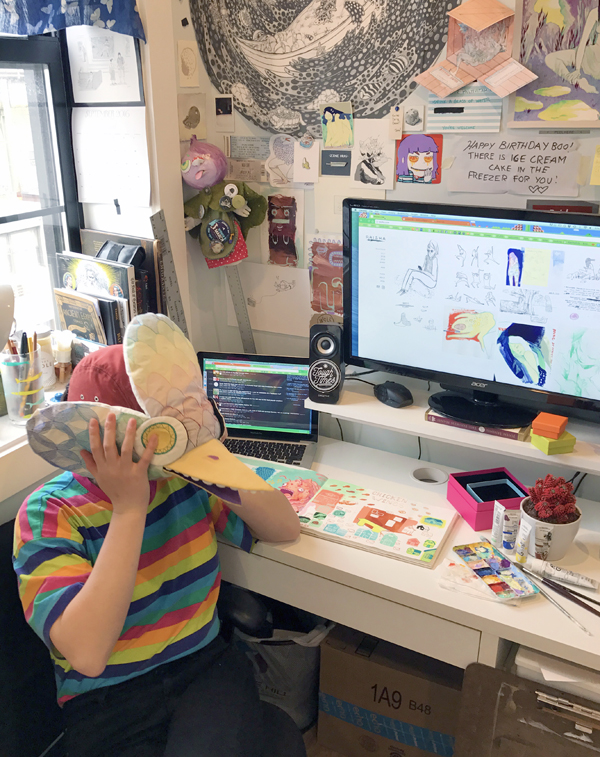
Identify the location of cup. (20, 382).